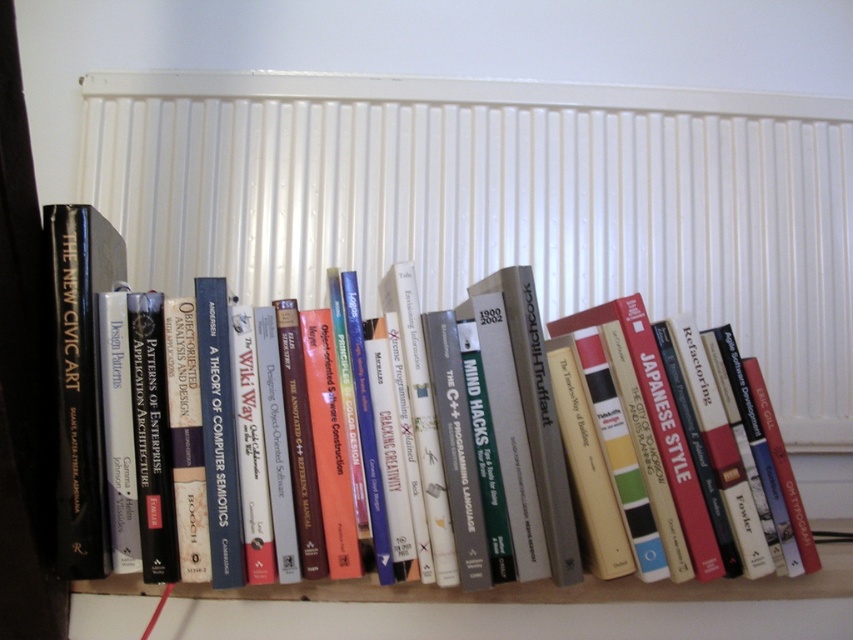
You are standing in front of a bookshelf with a radiator. There is a point labeled as point (498,202). What object is located at that point?

The white textured radiator at upper center is located at point (498,202).

You are organizing books on a shelf and want to place a new book between the hardcover book at center and the black hardcover book at left. Can you fit it there without moving any existing books?

The black hardcover book at left is behind the hardcover book at center, so there is no space between them for a new book. You would need to move at least one of the existing books to make room.

You are organizing books on a shelf and see the hardcover book at center and the black hardcover book at left. Which book is located to the left of the other?

The black hardcover book at left is located to the left of the hardcover book at center.